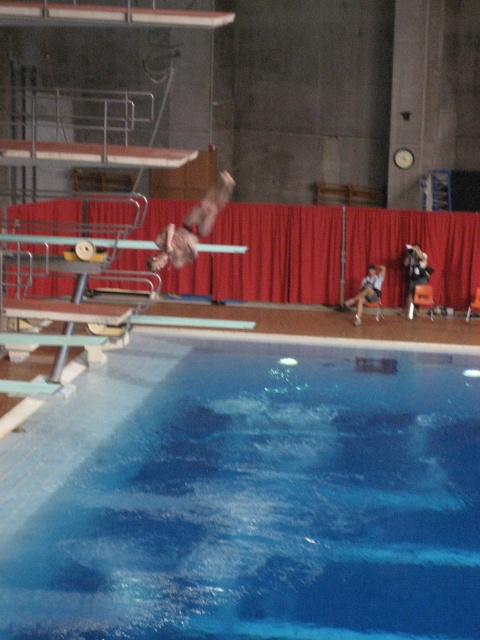
Which is above, brown leather jacket at center or matte metal diving board at center?

brown leather jacket at center is above.

Is brown leather jacket at center shorter than matte metal diving board at center?

No.

Between point (196, 227) and point (201, 244), which one is positioned in front?

Point (196, 227) is more forward.

Locate an element on the screen. brown leather jacket at center is located at coordinates (192, 227).

Is red velvet curtain at center further to the viewer compared to matte metal diving board at center?

Yes.

Locate an element on the screen. red velvet curtain at center is located at coordinates (267, 256).

Describe the element at coordinates (267, 256) in the screenshot. The height and width of the screenshot is (640, 480). I see `red velvet curtain at center` at that location.

This screenshot has height=640, width=480. I want to click on red velvet curtain at center, so click(x=267, y=256).

Can you confirm if red velvet curtain at center is shorter than white fabric shirt at center?

In fact, red velvet curtain at center may be taller than white fabric shirt at center.

Does point (238, 294) lie behind point (361, 310)?

That is True.

Find the location of `red velvet curtain at center`. red velvet curtain at center is located at coordinates (267, 256).